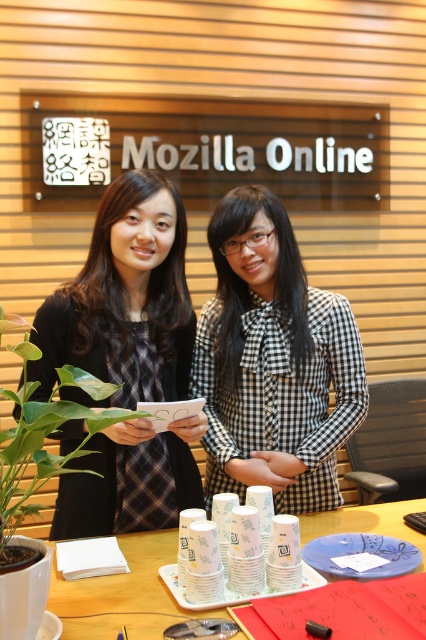
You are organizing a small event and need to know which item takes up more space on the table. Which one is larger between the black checkered blouse at center and the green leafy plant at left?

The green leafy plant at left is larger because the black checkered blouse at center occupies less space than it.

You are a photographer trying to capture a clear shot of both the matte black dress at center and the black checkered blouse at center. Since the camera can only focus on one subject at a time, which one should you focus on first to ensure the other is still in the frame?

The matte black dress at center is below the black checkered blouse at center, so focusing on the black checkered blouse at center first will ensure the dress is still in the frame below it.

You are standing in front of the Mozilla Online booth and want to pick up the item at point (89,508). If your arm can reach 1.2 meters, can you reach it?

The point (89,508) is 1.50 meters away from the viewer. Since your arm can only reach 1.2 meters, you cannot reach it.